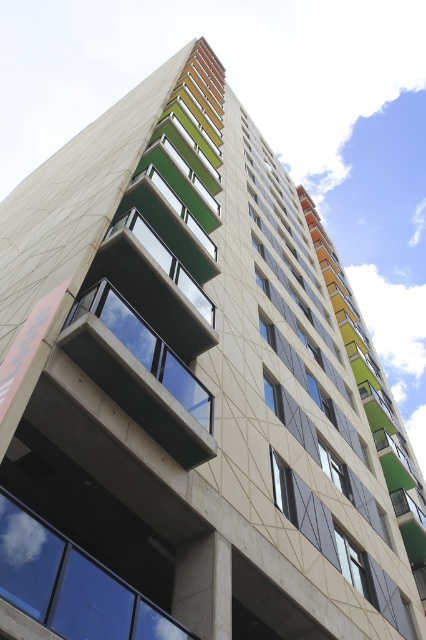
Who is higher up, transparent glass balcony at center or clear glass window at center?

transparent glass balcony at center is above.

From the picture: Is transparent glass balcony at center taller than clear glass window at center?

Indeed, transparent glass balcony at center has a greater height compared to clear glass window at center.

Between point (91, 301) and point (356, 589), which one is positioned in front?

Positioned in front is point (91, 301).

At what (x,y) coordinates should I click in order to perform the action: click on transparent glass balcony at center. Please return your answer as a coordinate pair (x, y). This screenshot has height=640, width=426. Looking at the image, I should click on (146, 348).

Which is in front, point (175, 624) or point (350, 577)?

Point (175, 624) is more forward.

The width and height of the screenshot is (426, 640). What do you see at coordinates (71, 584) in the screenshot? I see `transparent glass window at center` at bounding box center [71, 584].

Find the location of a particular element. This screenshot has width=426, height=640. transparent glass window at center is located at coordinates (71, 584).

Find the location of a particular element. transparent glass window at center is located at coordinates (71, 584).

Does transparent glass window at center have a larger size compared to transparent glass balcony at center?

Yes, transparent glass window at center is bigger than transparent glass balcony at center.

The image size is (426, 640). What are the coordinates of `transparent glass window at center` in the screenshot? It's located at (71, 584).